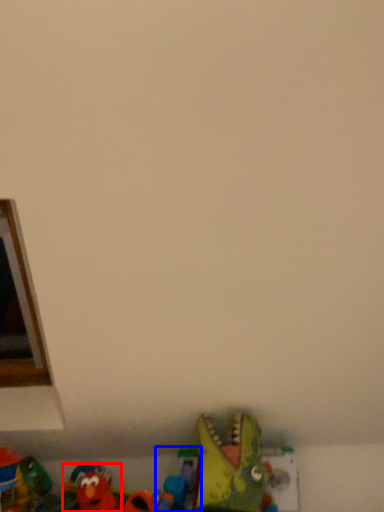
Question: Which object is further to the camera taking this photo, toy (highlighted by a red box) or toy (highlighted by a blue box)?

Choices:
 (A) toy
 (B) toy

Answer: (B)